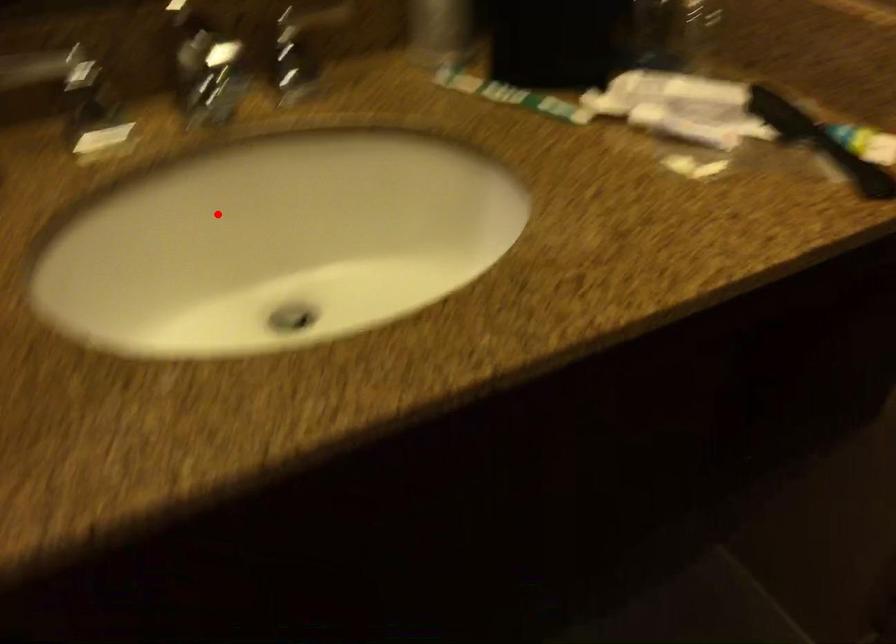
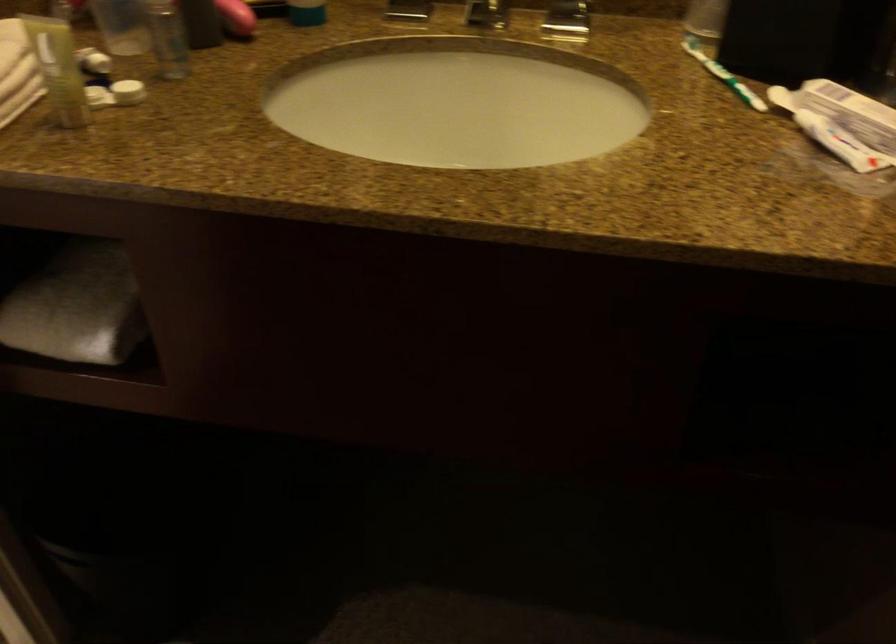
Question: I am providing you with two images of the same scene from different viewpoints. A red point is shown in image1. For the corresponding object point in image2, is it positioned nearer or farther from the camera?

Choices:
 (A) Nearer
 (B) Farther

Answer: (B)